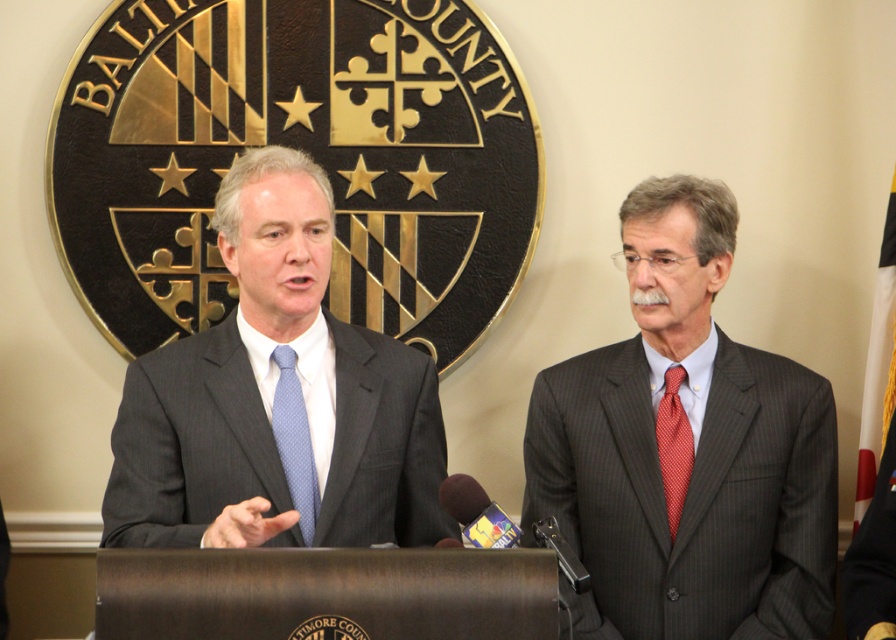
Is dark gray pinstripe suit at right wider than matte gray suit at center?

In fact, dark gray pinstripe suit at right might be narrower than matte gray suit at center.

Does point (565, 500) come behind point (394, 506)?

Yes, point (565, 500) is behind point (394, 506).

What do you see at coordinates (694, 451) in the screenshot? I see `dark gray pinstripe suit at right` at bounding box center [694, 451].

Where is `dark gray pinstripe suit at right`? dark gray pinstripe suit at right is located at coordinates (694, 451).

Is red textured tie at right positioned before metallic silver microphone at center?

No, it is not.

This screenshot has height=640, width=896. Describe the element at coordinates (673, 445) in the screenshot. I see `red textured tie at right` at that location.

Locate an element on the screen. red textured tie at right is located at coordinates (673, 445).

Which is behind, point (296, 381) or point (466, 525)?

Point (296, 381)

Who is taller, blue dotted tie at center or metallic silver microphone at center?

blue dotted tie at center is taller.

Is point (286, 435) more distant than point (488, 545)?

Yes, it is.

Locate an element on the screen. blue dotted tie at center is located at coordinates (294, 442).